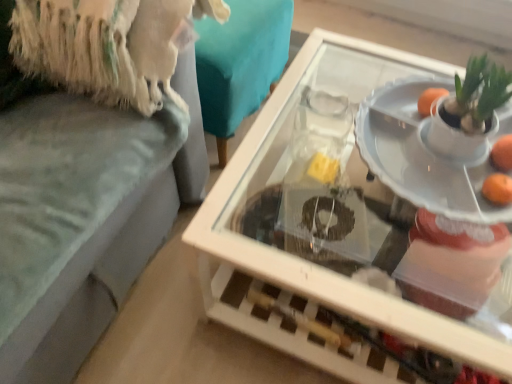
Locate an element on the screen. The width and height of the screenshot is (512, 384). free point to the left of orange matte at right, the second orange in the front-to-back sequence is located at coordinates (x=426, y=158).